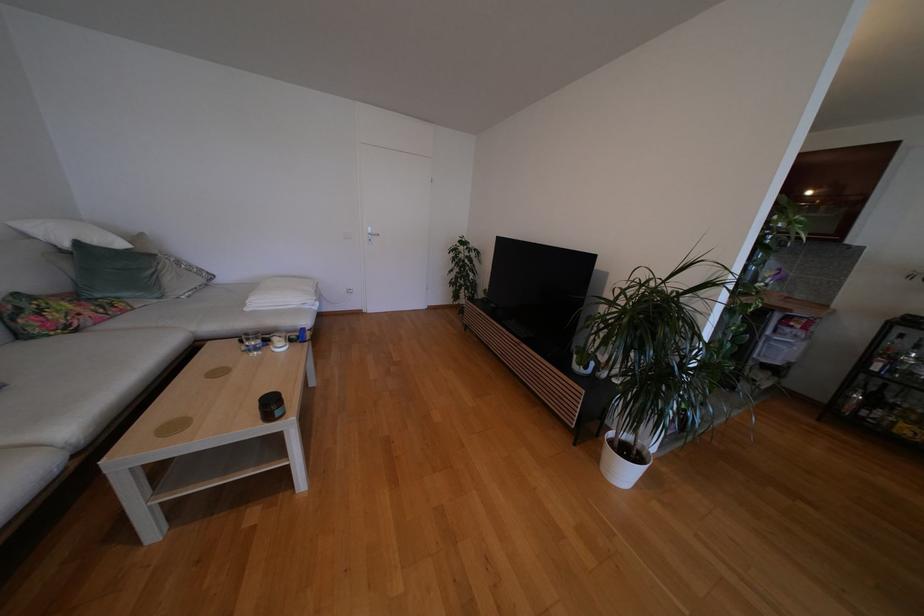
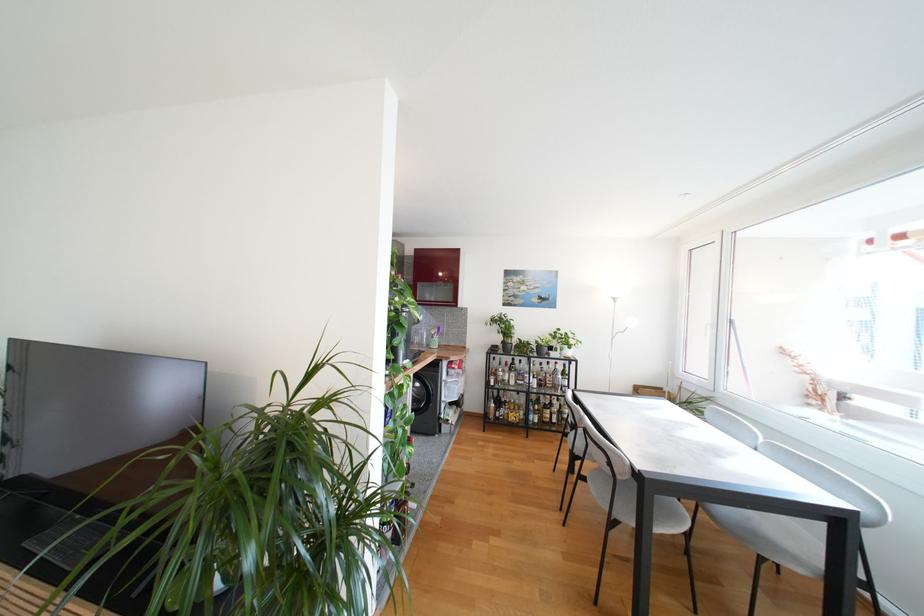
In the second image, find the point that corresponds to pixel 771 278 in the first image.

(436, 336)